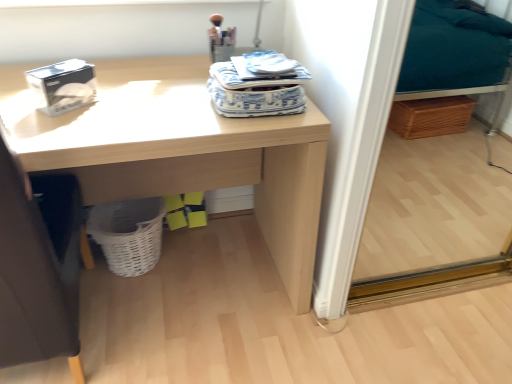
Find the location of a particular element. The height and width of the screenshot is (384, 512). vacant space to the right of white matte tissue box at upper left, the 1th box when ordered from front to back is located at coordinates (132, 104).